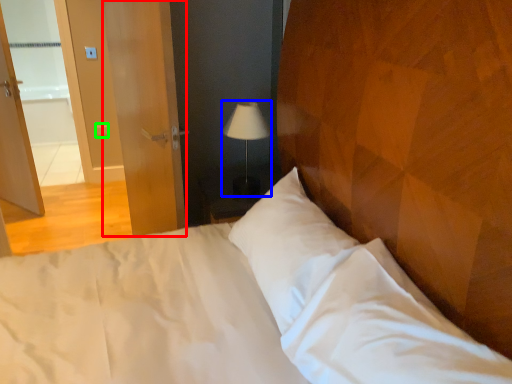
Question: Based on their relative distances, which object is nearer to screen door (highlighted by a red box)? Choose from lamp (highlighted by a blue box) and light switch (highlighted by a green box).

Choices:
 (A) lamp
 (B) light switch

Answer: (A)